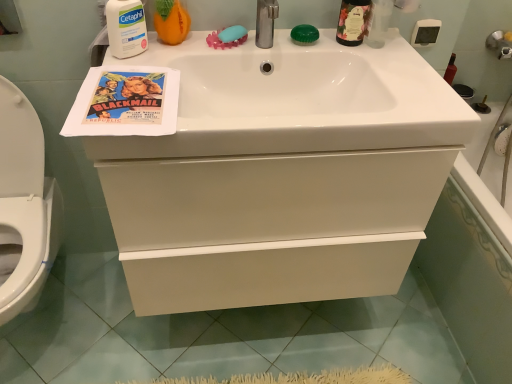
Locate an element on the screen. vacant space to the right of matte orange pumpkin at upper left, the 2th cleaning product from the left is located at coordinates (210, 43).